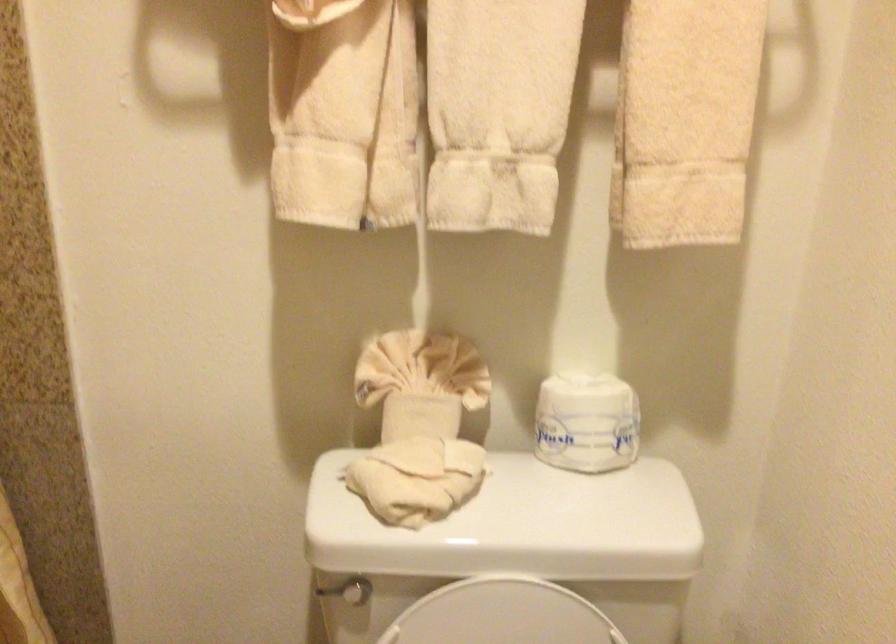
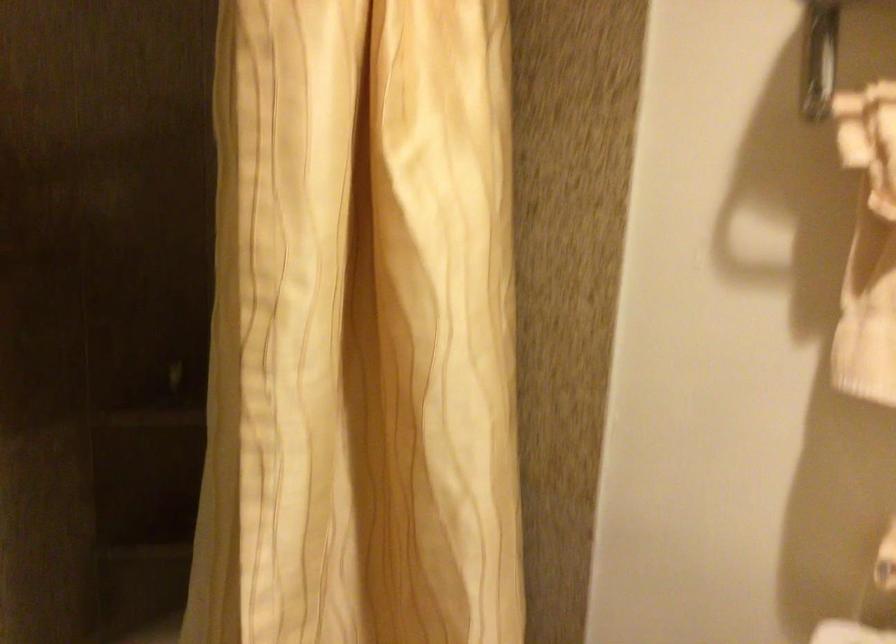
Question: The camera is either moving clockwise (left) or counter-clockwise (right) around the object. The first image is from the beginning of the video and the second image is from the end. Is the camera moving left or right when shooting the video?

Choices:
 (A) Left
 (B) Right

Answer: (B)